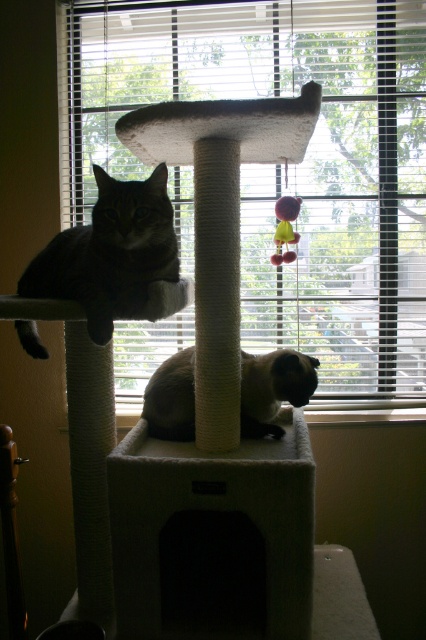
Question: Does white carpeted cat tree at center come behind plush yellow catnip toy at center?

Choices:
 (A) no
 (B) yes

Answer: (A)

Question: Is tabby fur cat at upper left closer to camera compared to white soft cat bed at lower center?

Choices:
 (A) yes
 (B) no

Answer: (B)

Question: Among these objects, which one is farthest from the camera?

Choices:
 (A) smokey gray fur at center
 (B) plush yellow catnip toy at center
 (C) white soft cat bed at lower center

Answer: (B)

Question: Which of the following is the closest to the observer?

Choices:
 (A) (132, 285)
 (B) (236, 486)
 (C) (284, 252)
 (D) (316, 604)

Answer: (B)

Question: Which of the following is the farthest from the observer?

Choices:
 (A) smokey gray fur at center
 (B) tabby fur cat at upper left

Answer: (A)

Question: From the image, what is the correct spatial relationship of white soft cat bed at lower center in relation to plush yellow catnip toy at center?

Choices:
 (A) right
 (B) left

Answer: (A)